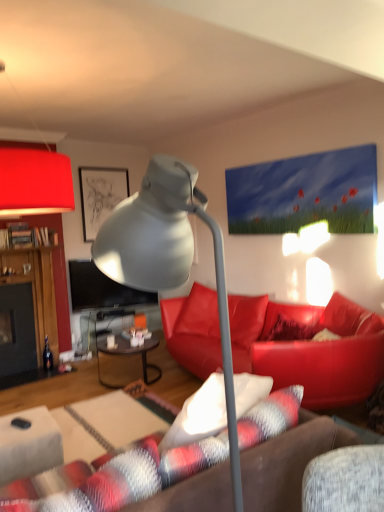
Question: Is leather couch at center at the left side of matte gray lamp at center, the 2th lamp viewed from the left?

Choices:
 (A) no
 (B) yes

Answer: (A)

Question: From a real-world perspective, does leather couch at center stand above matte gray lamp at center, the first lamp in the front-to-back sequence?

Choices:
 (A) yes
 (B) no

Answer: (B)

Question: Does leather couch at center have a greater width compared to matte gray lamp at center, the 2th lamp viewed from the left?

Choices:
 (A) no
 (B) yes

Answer: (B)

Question: Is leather couch at center with matte gray lamp at center, the first lamp in the front-to-back sequence?

Choices:
 (A) yes
 (B) no

Answer: (B)

Question: Does leather couch at center have a lesser width compared to matte gray lamp at center, the second lamp viewed from the top?

Choices:
 (A) yes
 (B) no

Answer: (B)

Question: Does leather couch at center contain matte gray lamp at center, the first lamp when ordered from bottom to top?

Choices:
 (A) yes
 (B) no

Answer: (B)

Question: Does matte black picture frame at upper left have a lesser width compared to leather couch at center?

Choices:
 (A) no
 (B) yes

Answer: (B)

Question: Considering the relative sizes of matte black picture frame at upper left and leather couch at center in the image provided, is matte black picture frame at upper left wider than leather couch at center?

Choices:
 (A) yes
 (B) no

Answer: (B)

Question: Is matte black picture frame at upper left not inside leather couch at center?

Choices:
 (A) yes
 (B) no

Answer: (A)

Question: Is the depth of matte black picture frame at upper left greater than that of leather couch at center?

Choices:
 (A) no
 (B) yes

Answer: (B)

Question: Is matte black picture frame at upper left oriented away from leather couch at center?

Choices:
 (A) no
 (B) yes

Answer: (A)

Question: Does matte black picture frame at upper left have a lesser height compared to leather couch at center?

Choices:
 (A) no
 (B) yes

Answer: (A)

Question: Does matte gray lamp at center, the first lamp in the front-to-back sequence, have a larger size compared to matte red lampshade at upper left, positioned as the second lamp in right-to-left order?

Choices:
 (A) no
 (B) yes

Answer: (A)